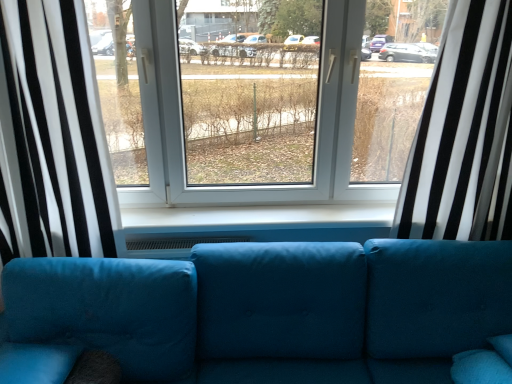
Question: Is velvet blue couch at center behind black/white striped curtain at left, marked as the 1th curtain in a left-to-right arrangement?

Choices:
 (A) no
 (B) yes

Answer: (A)

Question: Can you confirm if velvet blue couch at center is bigger than black/white striped curtain at left, the second curtain positioned from the right?

Choices:
 (A) no
 (B) yes

Answer: (B)

Question: From the image's perspective, is velvet blue couch at center located beneath black/white striped curtain at left, the second curtain positioned from the right?

Choices:
 (A) no
 (B) yes

Answer: (B)

Question: Is velvet blue couch at center outside of black/white striped curtain at left, marked as the 1th curtain in a left-to-right arrangement?

Choices:
 (A) no
 (B) yes

Answer: (B)

Question: Is black/white striped curtain at left, the second curtain positioned from the right, at the back of velvet blue couch at center?

Choices:
 (A) no
 (B) yes

Answer: (A)

Question: Would you say velvet blue couch at center is inside or outside black/white striped curtain at left, marked as the 1th curtain in a left-to-right arrangement?

Choices:
 (A) inside
 (B) outside

Answer: (B)

Question: Is velvet blue couch at center wider or thinner than black/white striped curtain at left, the second curtain positioned from the right?

Choices:
 (A) wide
 (B) thin

Answer: (A)

Question: From the image's perspective, is velvet blue couch at center above or below black/white striped curtain at left, marked as the 1th curtain in a left-to-right arrangement?

Choices:
 (A) below
 (B) above

Answer: (A)

Question: From their relative heights in the image, would you say velvet blue couch at center is taller or shorter than black/white striped curtain at left, marked as the 1th curtain in a left-to-right arrangement?

Choices:
 (A) short
 (B) tall

Answer: (A)

Question: Based on their positions, is black/white striped curtain at left, marked as the 1th curtain in a left-to-right arrangement, located to the left or right of velvet blue couch at center?

Choices:
 (A) right
 (B) left

Answer: (B)

Question: Is black/white striped curtain at left, marked as the 1th curtain in a left-to-right arrangement, taller or shorter than velvet blue couch at center?

Choices:
 (A) short
 (B) tall

Answer: (B)

Question: Do you think black/white striped curtain at left, marked as the 1th curtain in a left-to-right arrangement, is within velvet blue couch at center, or outside of it?

Choices:
 (A) outside
 (B) inside

Answer: (A)

Question: Does point (79, 195) appear closer or farther from the camera than point (180, 367)?

Choices:
 (A) closer
 (B) farther

Answer: (B)

Question: In terms of width, does white striped curtain at right, the 1th curtain when ordered from right to left, look wider or thinner when compared to black/white striped curtain at left, marked as the 1th curtain in a left-to-right arrangement?

Choices:
 (A) thin
 (B) wide

Answer: (A)

Question: Which is correct: white striped curtain at right, which is the second curtain from left to right, is inside black/white striped curtain at left, the second curtain positioned from the right, or outside of it?

Choices:
 (A) inside
 (B) outside

Answer: (B)